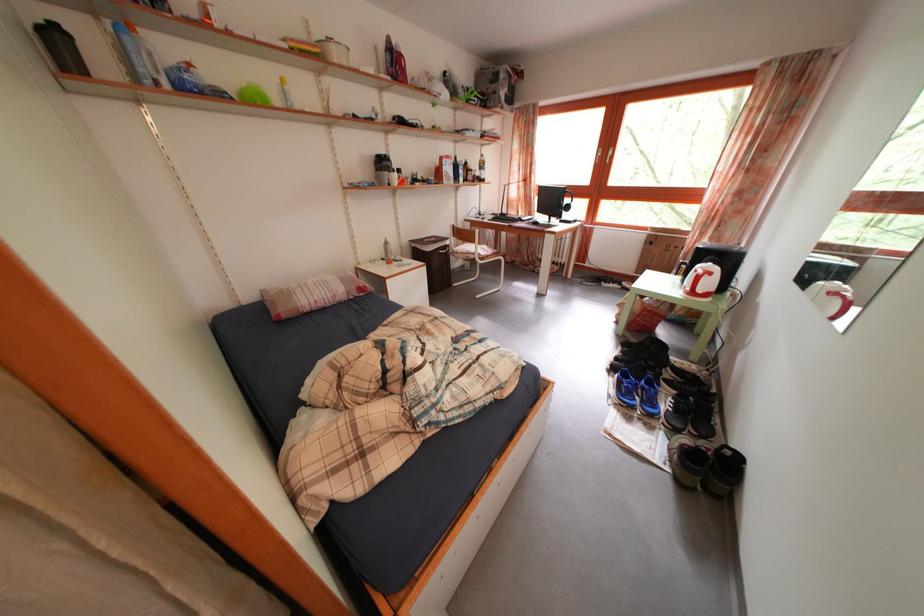
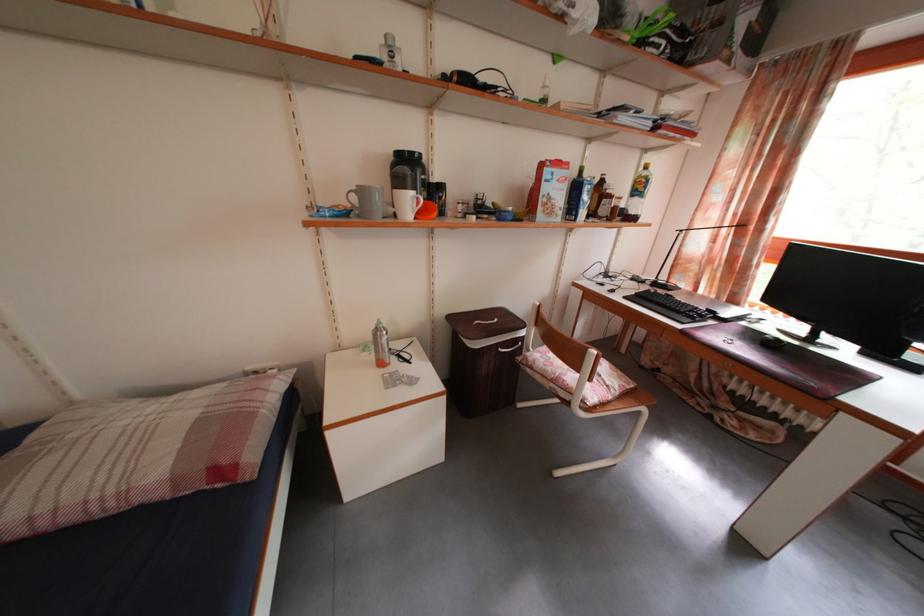
Locate, in the second image, the point that corresponds to the point at 513,217 in the first image.

(671, 285)